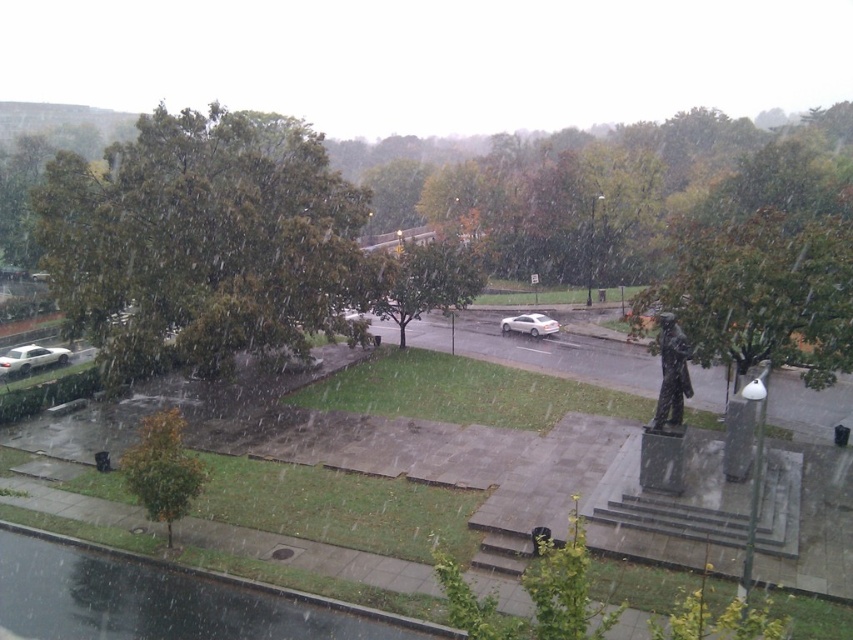
The width and height of the screenshot is (853, 640). Describe the element at coordinates (201, 241) in the screenshot. I see `green leafy tree at upper left` at that location.

Is green leafy tree at upper left shorter than white glossy sedan at lower left?

Incorrect, green leafy tree at upper left's height does not fall short of white glossy sedan at lower left's.

Measure the distance between point (136, 321) and camera.

Point (136, 321) is 96.88 feet from camera.

Where is `green leafy tree at upper left`? Image resolution: width=853 pixels, height=640 pixels. green leafy tree at upper left is located at coordinates (201, 241).

Which is behind, point (146, 353) or point (554, 323)?

Positioned behind is point (554, 323).

Between green leafy tree at upper left and satin silver sedan at center, which one has more height?

green leafy tree at upper left

Which is in front, point (155, 147) or point (531, 320)?

Point (155, 147)

In order to click on green leafy tree at upper left in this screenshot , I will do `click(201, 241)`.

Is white glossy sedan at lower left shorter than satin silver sedan at center?

Yes, white glossy sedan at lower left is shorter than satin silver sedan at center.

Who is shorter, white glossy sedan at lower left or satin silver sedan at center?

white glossy sedan at lower left

Which is in front, point (36, 353) or point (547, 328)?

Point (36, 353)

Where is `white glossy sedan at lower left`? The height and width of the screenshot is (640, 853). white glossy sedan at lower left is located at coordinates (32, 358).